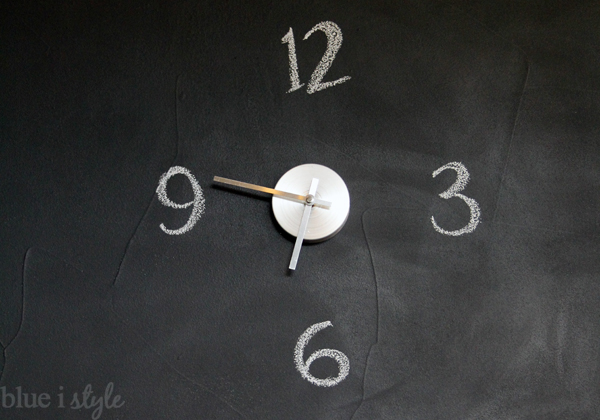
Locate an element on the screen. Image resolution: width=600 pixels, height=420 pixels. 2 metal clock hands in center is located at coordinates (259, 188), (297, 235).